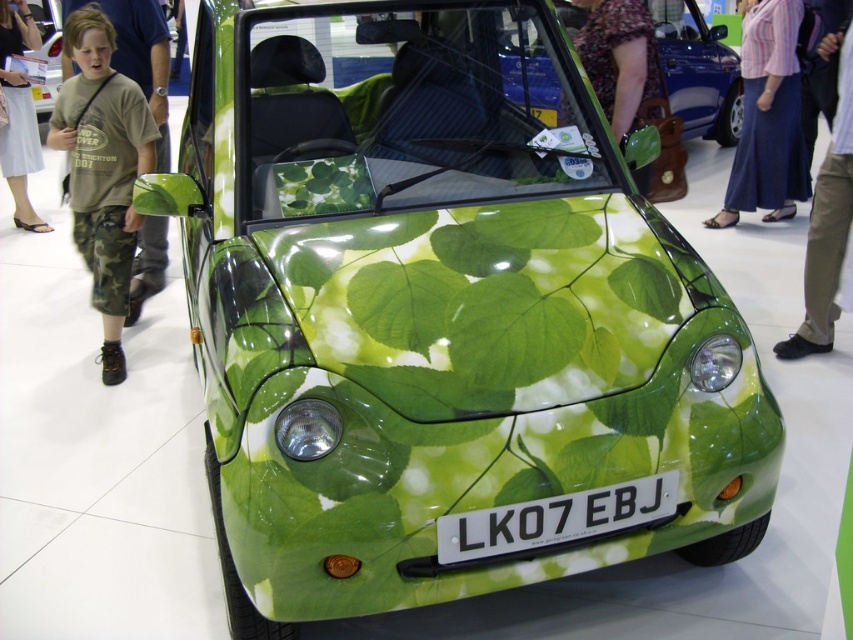
You are standing at the entrance of the exhibition hall where the car is displayed. You see two points marked on the floor near the car. The first point is at coordinate point (737,86) and the second is at point (851,212). If you are facing the car, which point is closer to the entrance?

Point (851,212) is closer to the entrance because it is in front of point (737,86) when facing the car.

You are standing in a car exhibition hall and want to take a photo of the car with the vibrant green leafy pattern. The car is parked at point (453, 536). If you are 7.45 feet away from the car, is it possible to capture the entire car in your camera frame without moving?

The point (453, 536) and viewer are 7.45 feet apart from each other. Assuming a typical camera lens with a standard field of view, capturing the entire car at this distance may depend on the car size and lens type. However, since the car is described as small and compact, it is likely possible to fit the entire car in the frame without moving.